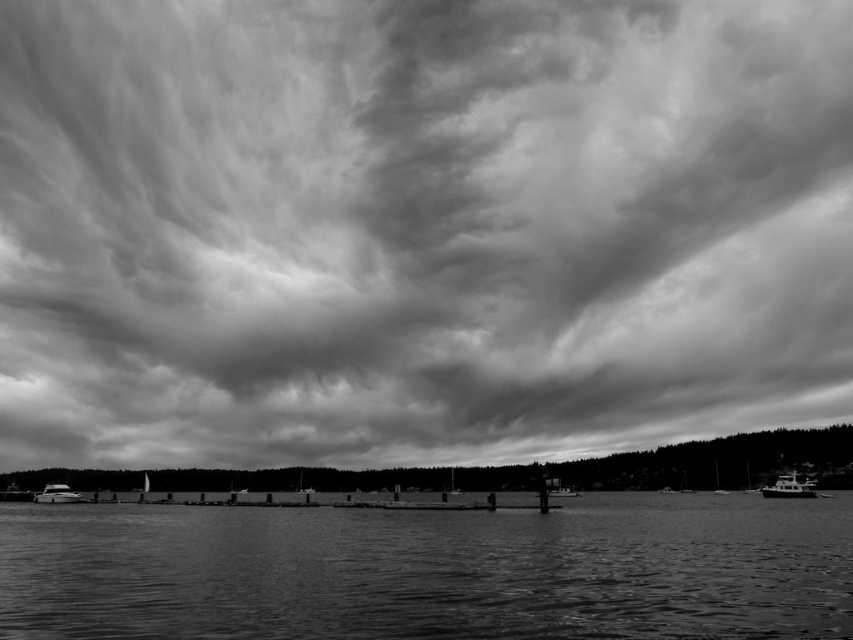
Looking at this image, can you confirm if smooth water at center is bigger than metallic silver boat at lower right?

Yes, smooth water at center is bigger than metallic silver boat at lower right.

Measure the distance between point (674, 563) and camera.

Point (674, 563) is 129.24 feet from camera.

Where is `smooth water at center`? The width and height of the screenshot is (853, 640). smooth water at center is located at coordinates (431, 572).

Does cloudy sky at upper center appear under metallic silver boat at lower right?

No.

Between point (654, 76) and point (798, 492), which one is positioned in front?

Point (798, 492) is more forward.

Between point (167, 243) and point (770, 490), which one is positioned behind?

The point (167, 243) is behind.

Locate an element on the screen. cloudy sky at upper center is located at coordinates (418, 227).

Between cloudy sky at upper center and smooth water at center, which one appears on the left side from the viewer's perspective?

Positioned to the left is cloudy sky at upper center.

Measure the distance from cloudy sky at upper center to smooth water at center.

1530.58 feet

Who is more distant from viewer, (708, 179) or (397, 534)?

Answer: The point (708, 179) is behind.

Find the location of `cloudy sky at upper center`. cloudy sky at upper center is located at coordinates (418, 227).